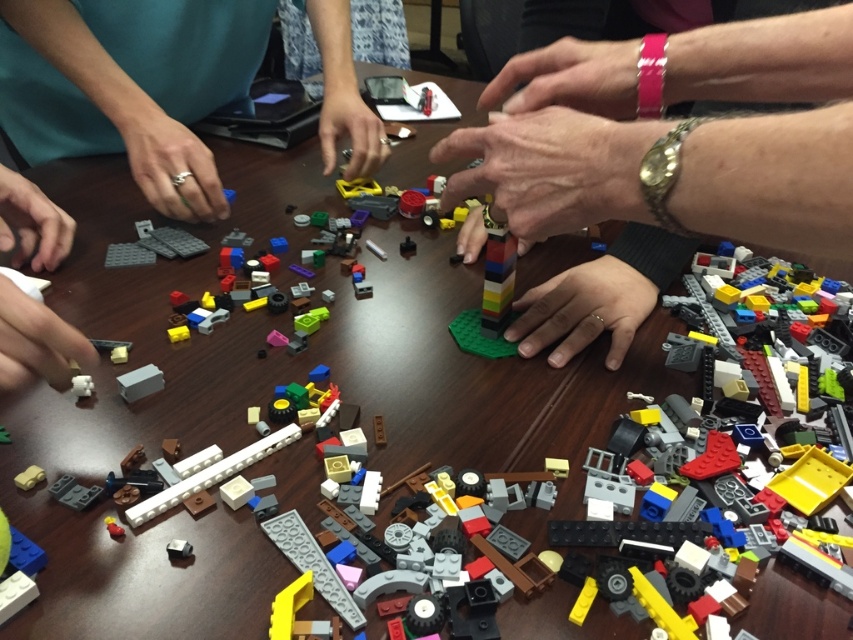
Does point (607, 92) come closer to viewer compared to point (6, 179)?

Yes, it is in front of point (6, 179).

Where is `pink rubber band at upper center`? The height and width of the screenshot is (640, 853). pink rubber band at upper center is located at coordinates (569, 77).

Between point (567, 60) and point (10, 179), which one is positioned in front?

Positioned in front is point (567, 60).

The width and height of the screenshot is (853, 640). What are the coordinates of `pink rubber band at upper center` in the screenshot? It's located at (569, 77).

Who is taller, smooth metallic watch at center or white matte plastic hand at lower left?

smooth metallic watch at center is taller.

Who is more forward, (459, 248) or (45, 369)?

Positioned in front is point (45, 369).

Does point (550, 122) come closer to viewer compared to point (68, 337)?

No, it is behind (68, 337).

Find the location of a particular element. smooth metallic watch at center is located at coordinates (549, 170).

Is point (346, 124) behind point (554, 321)?

Yes.

Who is more distant from viewer, (339, 68) or (613, 321)?

Point (339, 68)

Locate an element on the screen. This screenshot has height=640, width=853. matte green shirt at upper left is located at coordinates coord(123,109).